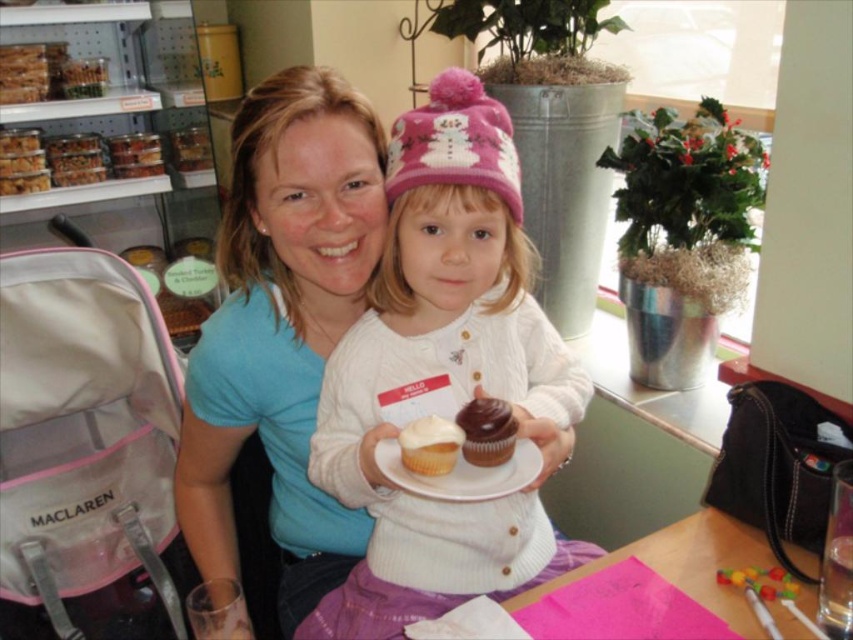
You are a photographer trying to capture a closeup of the white paper plate at center. To avoid blocking the view of the plate, should you position yourself to the left or right of the white knit sweater at center?

The white knit sweater at center is positioned on the left side of the white paper plate at center. Therefore, to avoid blocking the view of the plate, you should position yourself to the right of the white knit sweater at center.

You are a photographer standing in front of the bakery counter. You want to take a closeup photo of the white matte cupcake at center. However, the white paper plate at center is blocking your view. Can you move the plate to get a clear shot of the cupcake?

The white paper plate at center is closer to the viewer than the white matte cupcake at center, so moving the plate would allow you to see the cupcake behind it.